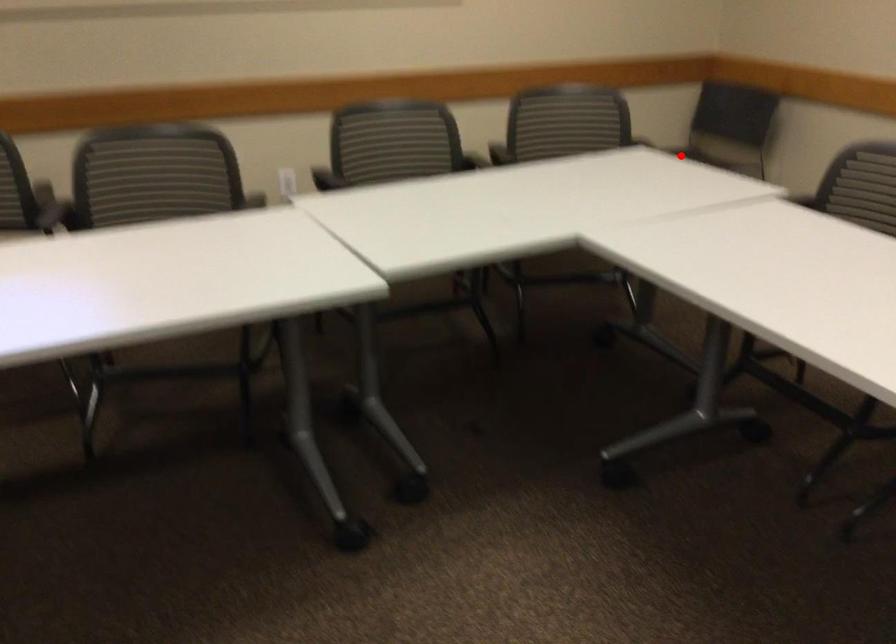
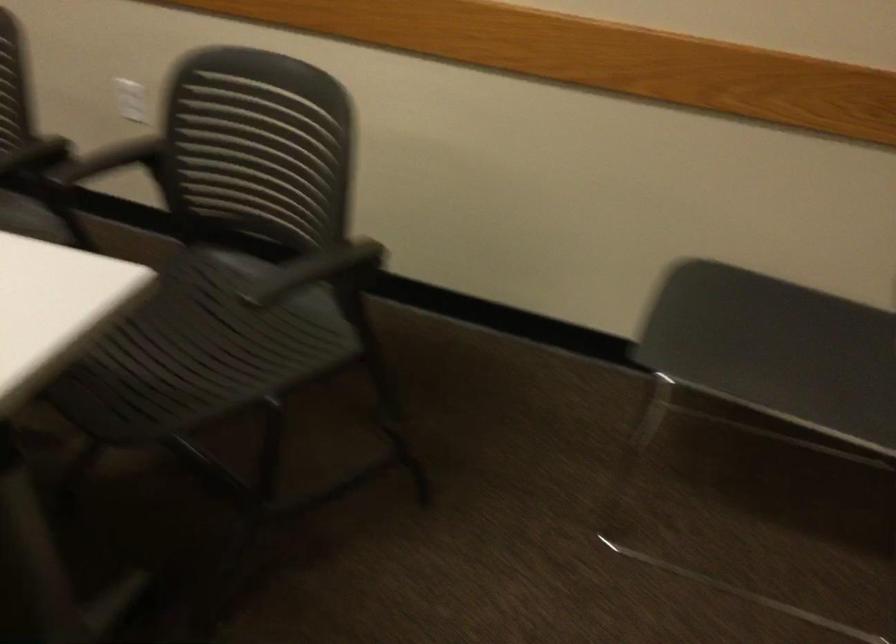
Question: I am providing you with two images of the same scene from different viewpoints. Given a red point in image1, look at the same physical point in image2. Is it:

Choices:
 (A) Closer to the viewpoint
 (B) Farther from the viewpoint

Answer: (A)